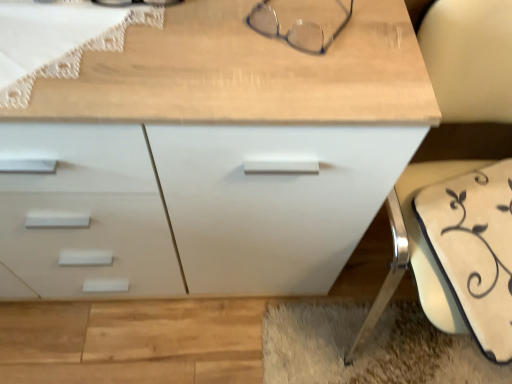
Identify the location of blank area to the left of clear plastic glasses at upper center. (205, 31).